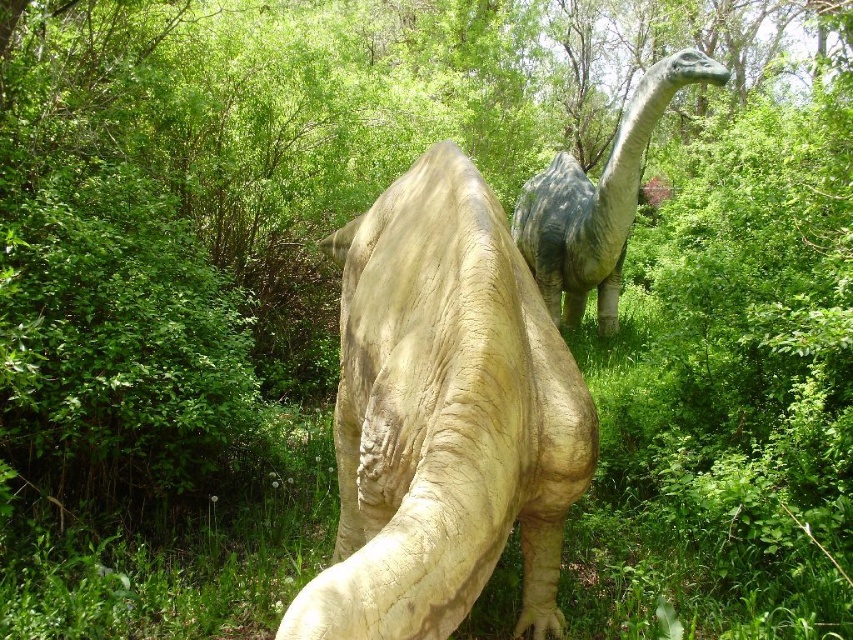
Question: Observing the image, what is the correct spatial positioning of matte beige dinosaur at center in reference to shiny gray dinosaur at center?

Choices:
 (A) below
 (B) above

Answer: (A)

Question: Does matte beige dinosaur at center come in front of shiny gray dinosaur at center?

Choices:
 (A) yes
 (B) no

Answer: (A)

Question: Is matte beige dinosaur at center to the right of shiny gray dinosaur at center from the viewer's perspective?

Choices:
 (A) no
 (B) yes

Answer: (A)

Question: Which point is farther to the camera?

Choices:
 (A) shiny gray dinosaur at center
 (B) matte beige dinosaur at center

Answer: (A)